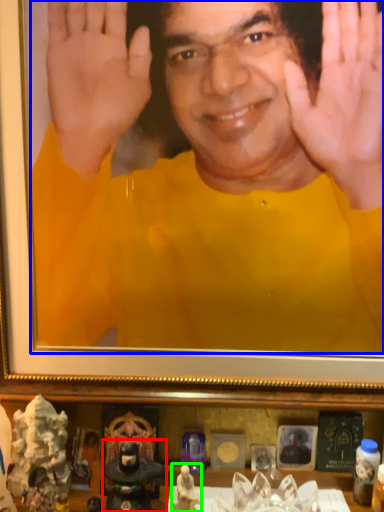
Question: Which object is positioned closest to figurine (highlighted by a red box)? Select from man (highlighted by a blue box) and toy (highlighted by a green box).

Choices:
 (A) man
 (B) toy

Answer: (B)